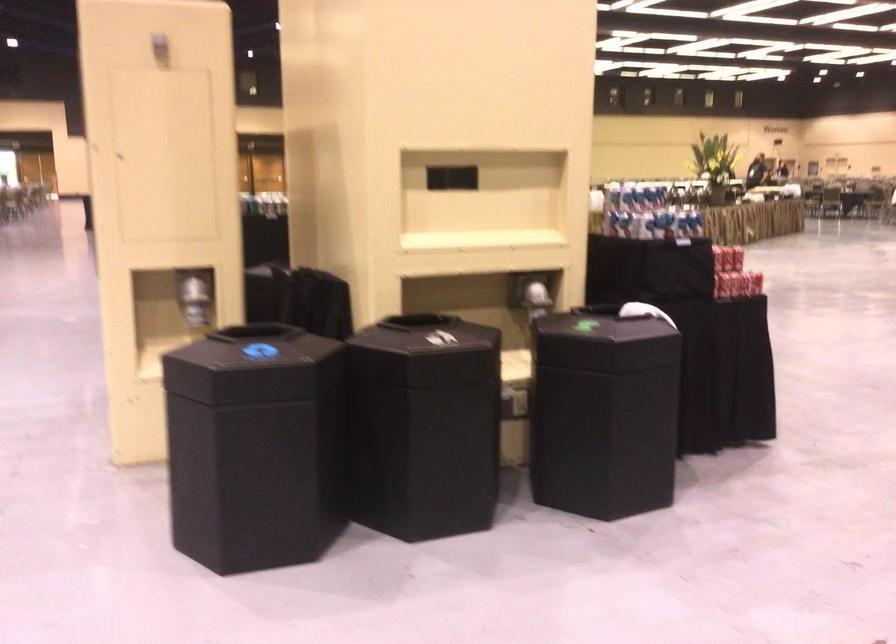
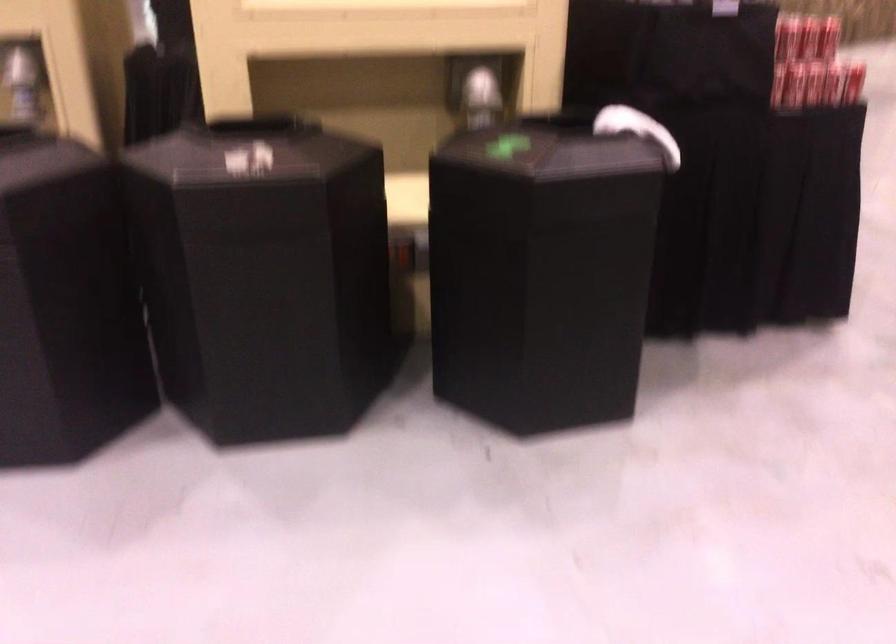
Locate, in the second image, the point that corresponds to (745,283) in the first image.

(810, 84)